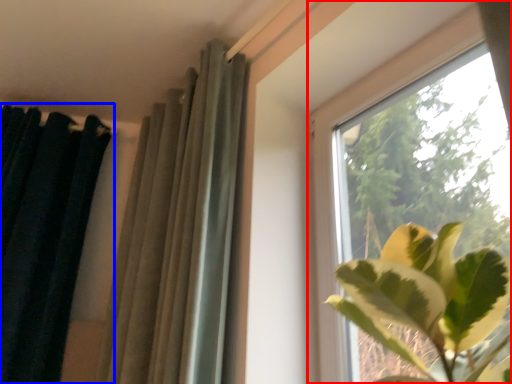
Question: Which object appears closest to the camera in this image, window (highlighted by a red box) or curtain (highlighted by a blue box)?

Choices:
 (A) window
 (B) curtain

Answer: (A)